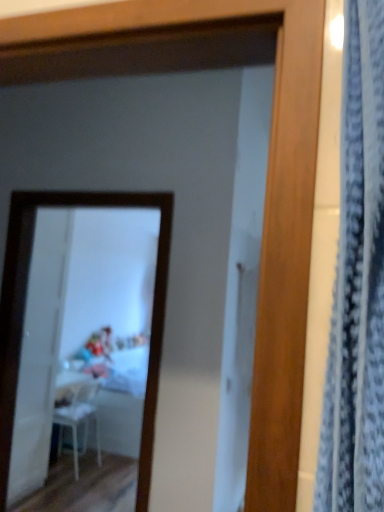
Question: Is blue textured curtain at right in front of or behind white plastic chair at lower left in the image?

Choices:
 (A) front
 (B) behind

Answer: (A)

Question: Does point (367, 81) appear closer or farther from the camera than point (91, 388)?

Choices:
 (A) closer
 (B) farther

Answer: (A)

Question: Which of these objects is positioned closest to the white glossy mirror at upper center?

Choices:
 (A) white plastic chair at lower left
 (B) white glossy table at center
 (C) transparent plastic screen door at left
 (D) blue textured curtain at right

Answer: (B)

Question: Based on their relative distances, which object is farther from the white glossy mirror at upper center?

Choices:
 (A) transparent plastic screen door at left
 (B) blue textured curtain at right
 (C) white glossy table at center
 (D) white plastic chair at lower left

Answer: (B)